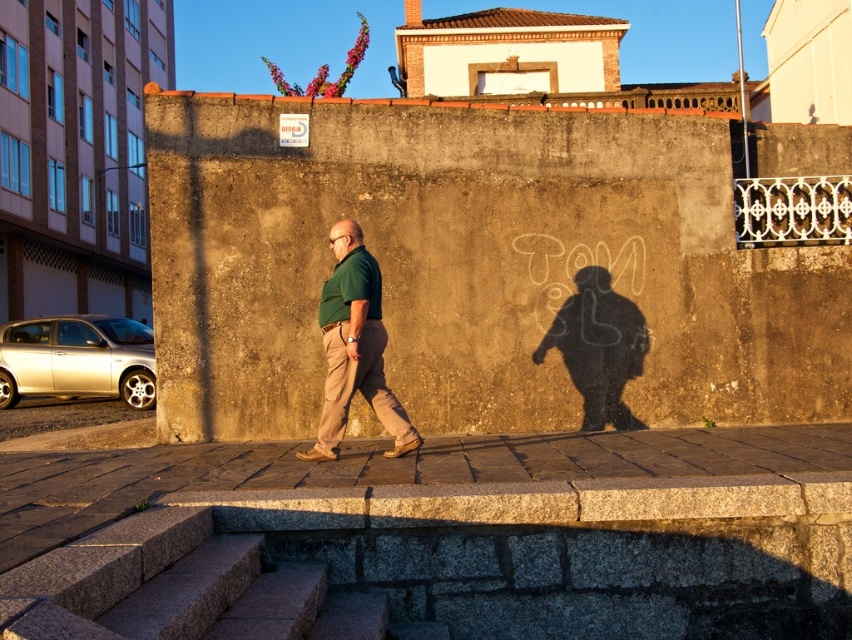
Based on the scene description, what is the 2D coordinate of the granite pavement at center?

The granite pavement at center is located at the 2D coordinate point of (377, 468).